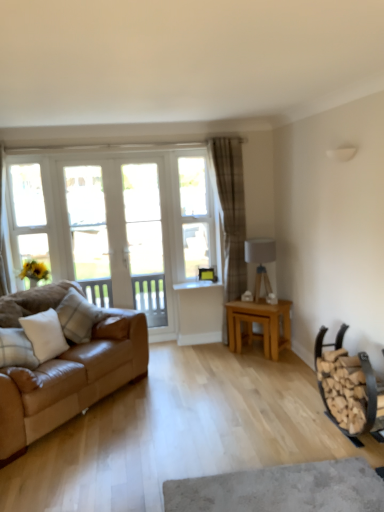
You are a GUI agent. You are given a task and a screenshot of the screen. Output one action in this format:
    pyautogui.click(x=<x>, y=<y>)
    Task: Click on the free space above white painted wood window frame at left (from a real-world perspective)
    
    Given the screenshot: What is the action you would take?
    pyautogui.click(x=30, y=154)